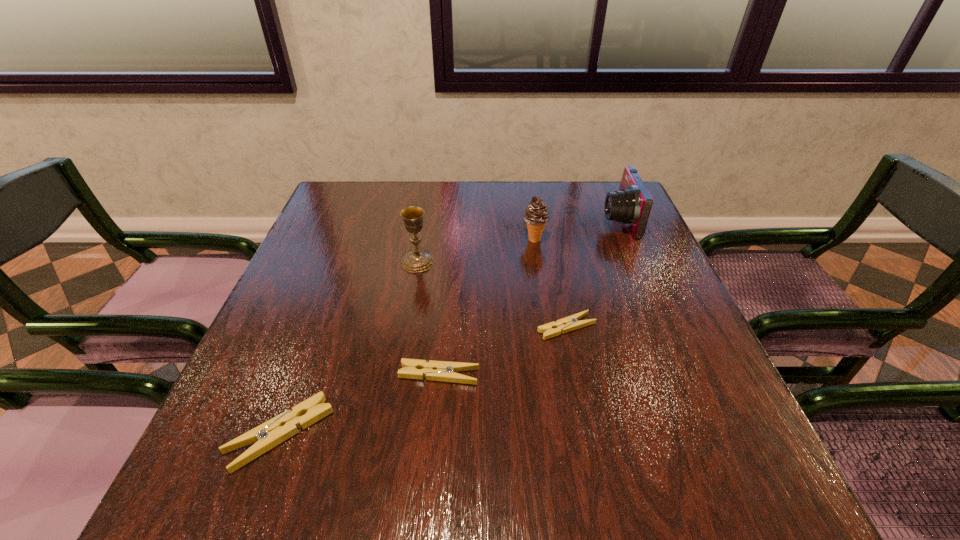
Please point a spot to add another clothespin on the right. Please provide its 2D coordinates. Your answer should be formatted as a tuple, i.e. [(x, y)], where the tuple contains the x and y coordinates of a point satisfying the conditions above.

[(671, 288)]